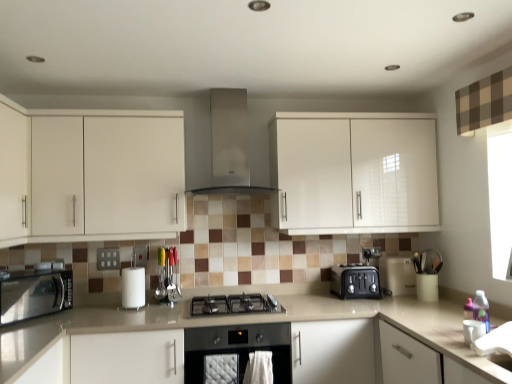
Question: Considering the relative sizes of white matte paper towel at center and satin silver range hood at center, which is the second home appliance in bottom-to-top order, in the image provided, is white matte paper towel at center thinner than satin silver range hood at center, which is the second home appliance in bottom-to-top order,?

Choices:
 (A) no
 (B) yes

Answer: (B)

Question: Can you confirm if white matte paper towel at center is taller than satin silver range hood at center, which is the second home appliance in bottom-to-top order?

Choices:
 (A) yes
 (B) no

Answer: (B)

Question: Does white matte paper towel at center come in front of satin silver range hood at center, arranged as the first home appliance when viewed from the top?

Choices:
 (A) no
 (B) yes

Answer: (A)

Question: Is white matte paper towel at center bigger than satin silver range hood at center, which is the second home appliance in bottom-to-top order?

Choices:
 (A) no
 (B) yes

Answer: (A)

Question: Can you confirm if white matte paper towel at center is shorter than satin silver range hood at center, which is the second home appliance in bottom-to-top order?

Choices:
 (A) yes
 (B) no

Answer: (A)

Question: Is white matte paper towel at center to the left of satin silver range hood at center, arranged as the first home appliance when viewed from the top, from the viewer's perspective?

Choices:
 (A) yes
 (B) no

Answer: (A)

Question: Is black stainless steel microwave at lower left, which ranks as the 1th kitchen appliance in left-to-right order, with white matte paper towel at center?

Choices:
 (A) no
 (B) yes

Answer: (A)

Question: Is black stainless steel microwave at lower left, which ranks as the 1th kitchen appliance in left-to-right order, thinner than white matte paper towel at center?

Choices:
 (A) no
 (B) yes

Answer: (A)

Question: Considering the relative sizes of black stainless steel microwave at lower left, which ranks as the second kitchen appliance in back-to-front order, and white matte paper towel at center in the image provided, is black stainless steel microwave at lower left, which ranks as the second kitchen appliance in back-to-front order, shorter than white matte paper towel at center?

Choices:
 (A) yes
 (B) no

Answer: (B)

Question: Could white matte paper towel at center be considered to be inside black stainless steel microwave at lower left, which ranks as the second kitchen appliance in back-to-front order?

Choices:
 (A) yes
 (B) no

Answer: (B)

Question: From a real-world perspective, is black stainless steel microwave at lower left, which ranks as the 1th kitchen appliance in left-to-right order, located beneath white matte paper towel at center?

Choices:
 (A) yes
 (B) no

Answer: (B)

Question: Can you confirm if black stainless steel microwave at lower left, the 1th kitchen appliance positioned from the front, is positioned to the right of white matte paper towel at center?

Choices:
 (A) yes
 (B) no

Answer: (B)

Question: Is white glossy cabinet at upper left, the first cabinetry when ordered from left to right, positioned in front of black stainless steel microwave at lower left, the 1th kitchen appliance positioned from the front?

Choices:
 (A) yes
 (B) no

Answer: (B)